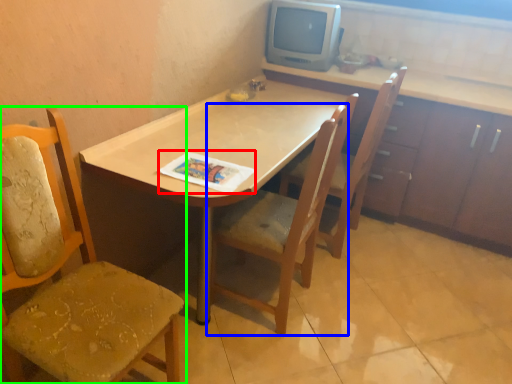
Question: Which object is positioned closest to magazine (highlighted by a red box)? Select from chair (highlighted by a blue box) and chair (highlighted by a green box).

Choices:
 (A) chair
 (B) chair

Answer: (A)